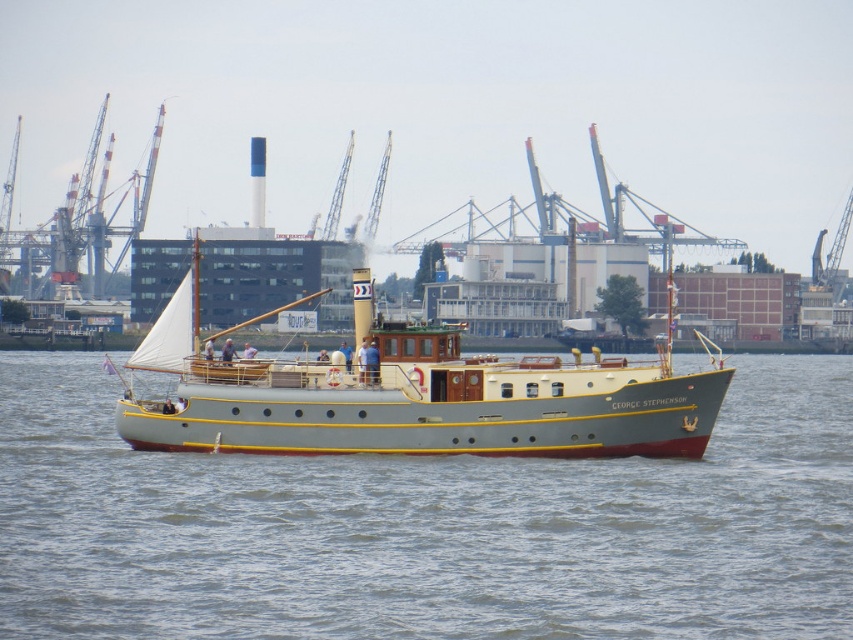
You are standing on the deck of the George Stephenson yacht and want to take a photo. There are two points marked on the deck at coordinates point [405,460] and point [192,422]. Which point will appear larger in your photo?

Point [405,460] is closer to the camera than point [192,422]. Since objects closer to the camera appear larger in photos, the point at [405,460] will appear larger in the photo.